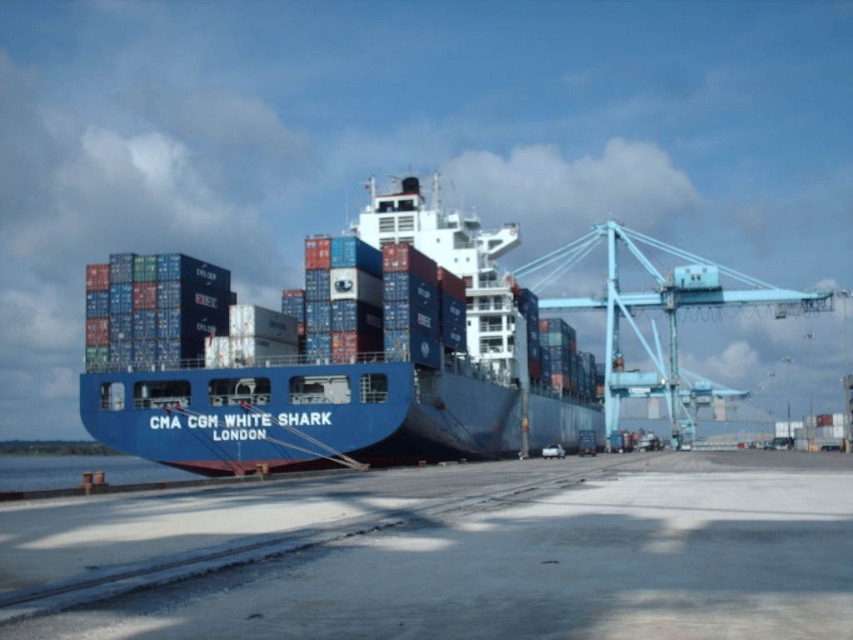
Question: Is blue matte container ship at center further to the viewer compared to blue metallic crane at right?

Choices:
 (A) yes
 (B) no

Answer: (B)

Question: Can you confirm if blue matte container ship at center is positioned to the right of blue metallic crane at right?

Choices:
 (A) no
 (B) yes

Answer: (A)

Question: Which point is farther to the camera?

Choices:
 (A) (184, 364)
 (B) (758, 300)

Answer: (B)

Question: Which point appears closest to the camera in this image?

Choices:
 (A) coord(463,378)
 (B) coord(688,257)

Answer: (A)

Question: Which object is the closest to the blue metallic crane at right?

Choices:
 (A) blue water at lower left
 (B) blue matte container ship at center

Answer: (B)

Question: Is the position of blue metallic crane at right less distant than that of blue water at lower left?

Choices:
 (A) yes
 (B) no

Answer: (B)